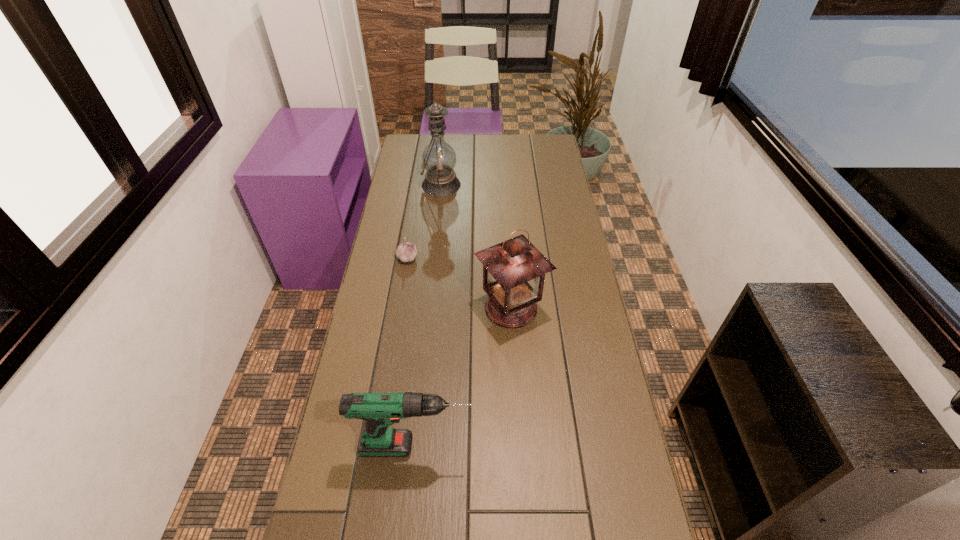
Find the location of a particular element. vacant area that lies between the shortest object and the second shortest object is located at coordinates (412, 352).

Identify the location of blank region between the right oil lamp and the second shortest object. (464, 377).

The width and height of the screenshot is (960, 540). I want to click on free space between the left oil lamp and the garlic, so click(424, 221).

I want to click on unoccupied area between the left oil lamp and the nearer oil lamp, so click(476, 246).

Identify the location of free space between the second shortest object and the farther oil lamp. (429, 315).

Find the location of `free space that is in between the drill and the garlic`. free space that is in between the drill and the garlic is located at coordinates click(412, 352).

Identify the location of free spot between the farther oil lamp and the nearest object. This screenshot has height=540, width=960. coord(429,315).

Locate which object ranks second in proximity to the left oil lamp. Please provide its 2D coordinates. Your answer should be formatted as a tuple, i.e. [(x, y)], where the tuple contains the x and y coordinates of a point satisfying the conditions above.

[(514, 271)]

This screenshot has width=960, height=540. What are the coordinates of `object that stands as the closest to the drill` in the screenshot? It's located at (514, 271).

The width and height of the screenshot is (960, 540). What are the coordinates of `vacant space that satisfies the following two spatial constraints: 1. on the front side of the third farthest object; 2. on the handle side of the nearest object` in the screenshot? It's located at (519, 447).